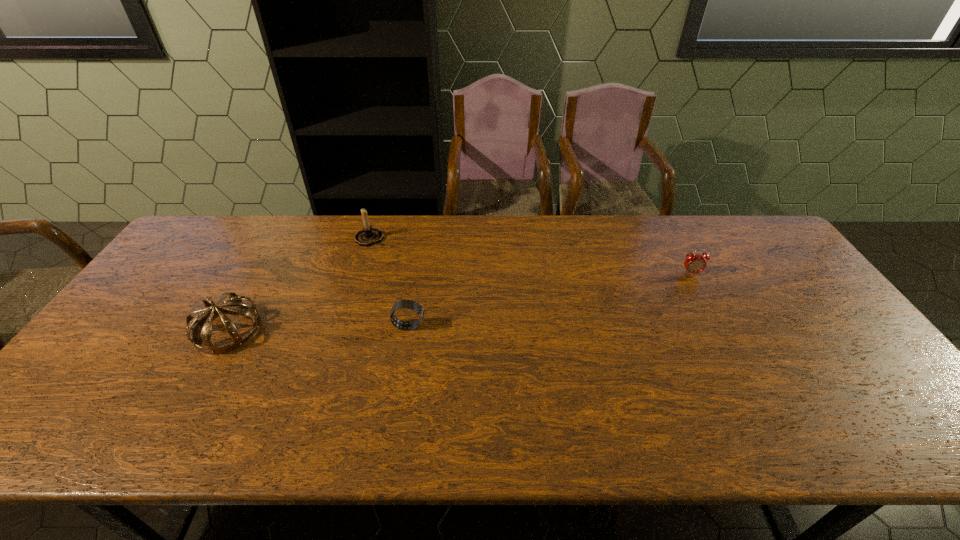
Where is `candle holder`? Image resolution: width=960 pixels, height=540 pixels. candle holder is located at coordinates (369, 235).

Locate an element on the screen. The width and height of the screenshot is (960, 540). the second object from left to right is located at coordinates (369, 235).

Image resolution: width=960 pixels, height=540 pixels. In order to click on the leftmost object in this screenshot , I will do `click(236, 305)`.

Where is `alarm clock`? The height and width of the screenshot is (540, 960). alarm clock is located at coordinates (694, 263).

The image size is (960, 540). Identify the location of the rightmost object. (694, 263).

Locate an element on the screen. the third object from left to right is located at coordinates (409, 304).

Locate an element on the screen. Image resolution: width=960 pixels, height=540 pixels. vacant space located 0.170m on the front of the farthest object is located at coordinates (355, 284).

At what (x,y) coordinates should I click in order to perform the action: click on vacant area situated 0.100m on the front of the tiara. Please return your answer as a coordinate pair (x, y). Looking at the image, I should click on (194, 390).

Find the location of a particular element. vacant area situated 0.210m on the face of the rightmost object is located at coordinates (721, 328).

At what (x,y) coordinates should I click in order to perform the action: click on vacant space located on the face of the third object from left to right. Please return your answer as a coordinate pair (x, y). Looking at the image, I should click on (447, 326).